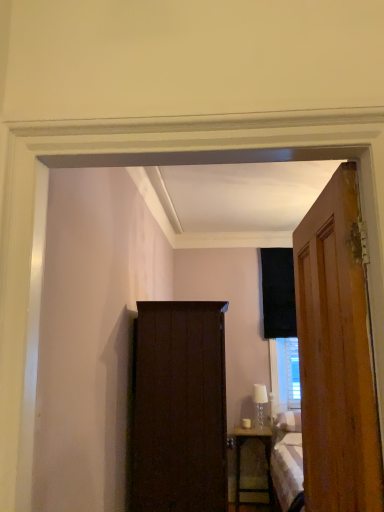
Question: Considering the relative sizes of wooden door at right and dark wood cabinet at center in the image provided, is wooden door at right shorter than dark wood cabinet at center?

Choices:
 (A) yes
 (B) no

Answer: (A)

Question: Is wooden door at right at the left side of dark wood cabinet at center?

Choices:
 (A) no
 (B) yes

Answer: (A)

Question: Would you consider wooden door at right to be distant from dark wood cabinet at center?

Choices:
 (A) no
 (B) yes

Answer: (B)

Question: Is wooden door at right at the right side of dark wood cabinet at center?

Choices:
 (A) yes
 (B) no

Answer: (A)

Question: Can you confirm if wooden door at right is wider than dark wood cabinet at center?

Choices:
 (A) no
 (B) yes

Answer: (A)

Question: Is wooden door at right smaller than dark wood cabinet at center?

Choices:
 (A) yes
 (B) no

Answer: (A)

Question: Is wooden nightstand at lower right positioned in front of wooden door at right?

Choices:
 (A) no
 (B) yes

Answer: (A)

Question: Is wooden nightstand at lower right not near wooden door at right?

Choices:
 (A) yes
 (B) no

Answer: (A)

Question: Does wooden nightstand at lower right have a larger size compared to wooden door at right?

Choices:
 (A) no
 (B) yes

Answer: (A)

Question: Considering the relative sizes of wooden nightstand at lower right and wooden door at right in the image provided, is wooden nightstand at lower right wider than wooden door at right?

Choices:
 (A) yes
 (B) no

Answer: (A)

Question: Does wooden nightstand at lower right have a lesser height compared to wooden door at right?

Choices:
 (A) no
 (B) yes

Answer: (B)

Question: Considering the relative positions of wooden nightstand at lower right and wooden door at right in the image provided, is wooden nightstand at lower right to the right of wooden door at right from the viewer's perspective?

Choices:
 (A) yes
 (B) no

Answer: (A)

Question: Does white glass lamp at center appear on the left side of dark wood cabinet at center?

Choices:
 (A) no
 (B) yes

Answer: (A)